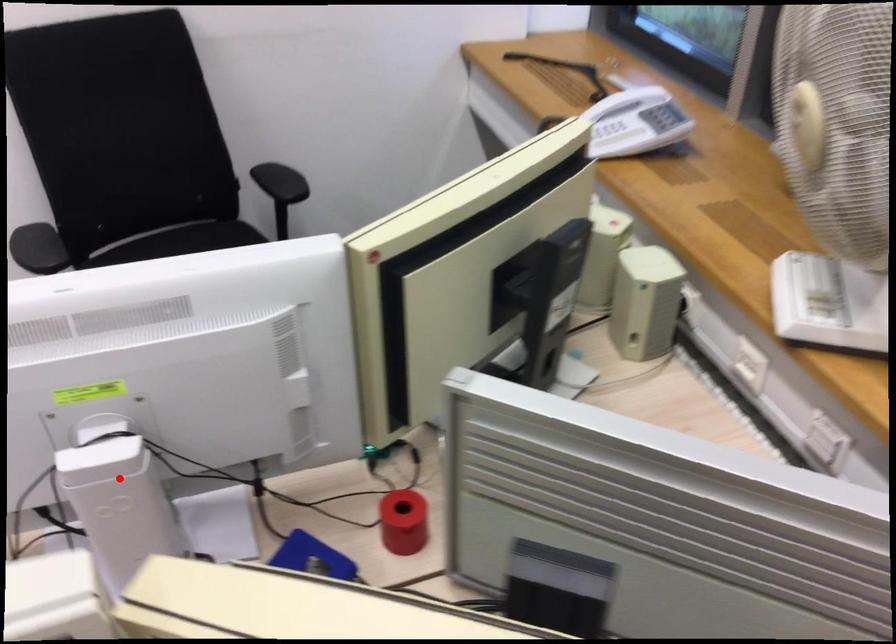
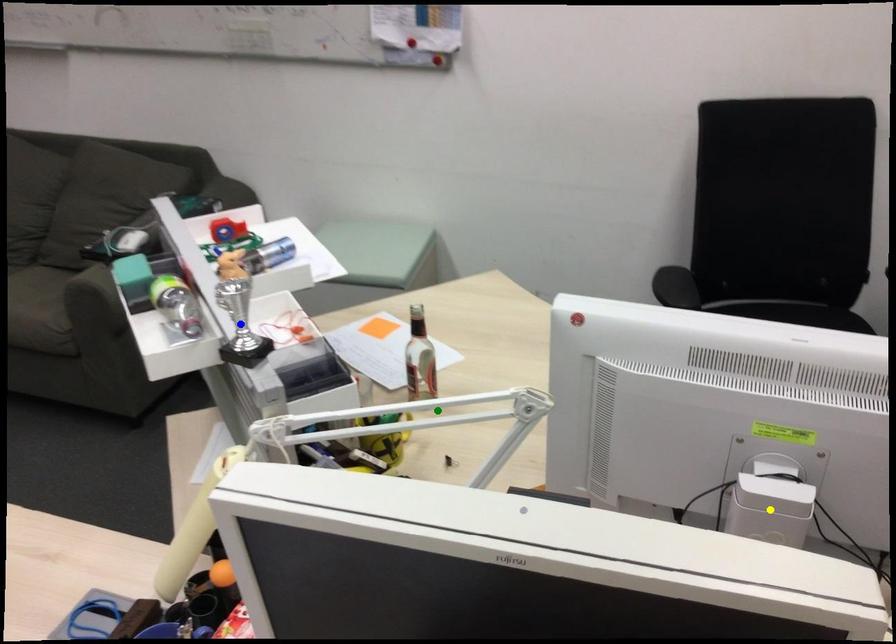
Question: I am providing you with two images of the same scene from different viewpoints. A red point is marked on the first image. You are given multiple points on the second image. Which mark in image 2 goes with the point in image 1?

Choices:
 (A) yellow point
 (B) green point
 (C) blue point

Answer: (A)